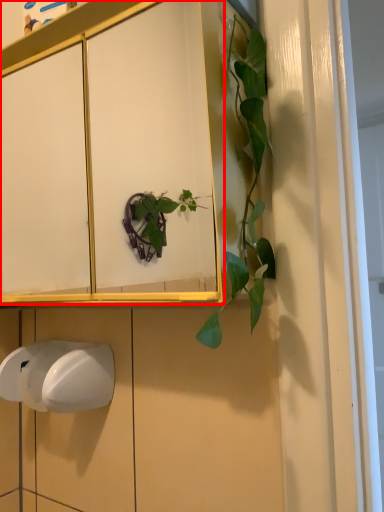
Question: From the image, what is the correct spatial relationship of cabinetry (annotated by the red box) in relation to hand dryer?

Choices:
 (A) right
 (B) left

Answer: (A)